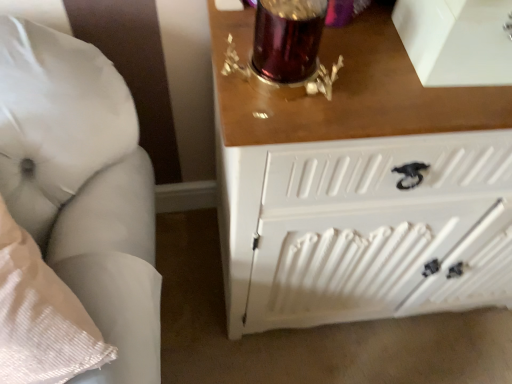
Where is `white painted wood radiator at lower right`? Image resolution: width=512 pixels, height=384 pixels. white painted wood radiator at lower right is located at coordinates (380, 264).

Describe the element at coordinates (380, 264) in the screenshot. Image resolution: width=512 pixels, height=384 pixels. I see `white painted wood radiator at lower right` at that location.

What is the approximate width of white fabric pillow at left?

The width of white fabric pillow at left is 9.09 inches.

What do you see at coordinates (83, 186) in the screenshot?
I see `white fabric pillow at left` at bounding box center [83, 186].

Find the location of a particular element. white fabric pillow at left is located at coordinates (83, 186).

Identify the location of white painted wood radiator at lower right. Image resolution: width=512 pixels, height=384 pixels. (380, 264).

Considering the positions of objects white painted wood radiator at lower right and white fabric pillow at left in the image provided, who is more to the right, white painted wood radiator at lower right or white fabric pillow at left?

Positioned to the right is white painted wood radiator at lower right.

From the picture: Does white painted wood radiator at lower right come behind white fabric pillow at left?

Yes, white painted wood radiator at lower right is further from the camera.

Considering the positions of point (398, 252) and point (113, 193), is point (398, 252) closer or farther from the camera than point (113, 193)?

Point (398, 252) is farther from the camera than point (113, 193).

From the image's perspective, is white painted wood radiator at lower right located beneath white fabric pillow at left?

Indeed, from the image's perspective, white painted wood radiator at lower right is shown beneath white fabric pillow at left.

In the scene shown: From a real-world perspective, who is located higher, white painted wood radiator at lower right or white fabric pillow at left?

From a 3D spatial view, white fabric pillow at left is above.

In terms of width, does white painted wood radiator at lower right look wider or thinner when compared to white fabric pillow at left?

Clearly, white painted wood radiator at lower right has more width compared to white fabric pillow at left.

Who is taller, white painted wood radiator at lower right or white fabric pillow at left?

Standing taller between the two is white fabric pillow at left.

Between white painted wood radiator at lower right and white fabric pillow at left, which one has smaller size?

With smaller size is white painted wood radiator at lower right.

Is white painted wood radiator at lower right surrounding white fabric pillow at left?

Actually, white fabric pillow at left is outside white painted wood radiator at lower right.

Are white painted wood radiator at lower right and white fabric pillow at left located far from each other?

white painted wood radiator at lower right is near white fabric pillow at left, not far away.

Is white painted wood radiator at lower right aimed at white fabric pillow at left?

No.

How different are the orientations of white painted wood radiator at lower right and white fabric pillow at left in degrees?

The angular difference between white painted wood radiator at lower right and white fabric pillow at left is 28.9 degrees.

Locate an element on the screen. furniture on the left of the white painted wood radiator at lower right is located at coordinates (83, 186).

Considering the relative positions of white fabric pillow at left and white painted wood radiator at lower right in the image provided, is white fabric pillow at left to the left or to the right of white painted wood radiator at lower right?

white fabric pillow at left is to the left of white painted wood radiator at lower right.

Which object is closer to the camera, white fabric pillow at left or white painted wood radiator at lower right?

Positioned in front is white fabric pillow at left.

Which point is more forward, (35, 236) or (403, 250)?

The point (35, 236) is closer.

From the image's perspective, which one is positioned lower, white fabric pillow at left or white painted wood radiator at lower right?

white painted wood radiator at lower right.

From a real-world perspective, which object rests below the other?

In real-world perspective, white painted wood radiator at lower right is lower.

Which object is thinner, white fabric pillow at left or white painted wood radiator at lower right?

Thinner between the two is white fabric pillow at left.

Considering the relative sizes of white fabric pillow at left and white painted wood radiator at lower right in the image provided, is white fabric pillow at left taller than white painted wood radiator at lower right?

Correct, white fabric pillow at left is much taller as white painted wood radiator at lower right.

Does white fabric pillow at left have a larger size compared to white painted wood radiator at lower right?

Correct, white fabric pillow at left is larger in size than white painted wood radiator at lower right.

Can white painted wood radiator at lower right be found inside white fabric pillow at left?

Actually, white painted wood radiator at lower right is outside white fabric pillow at left.

Is white fabric pillow at left directly adjacent to white painted wood radiator at lower right?

No, white fabric pillow at left is not with white painted wood radiator at lower right.

Is white painted wood radiator at lower right at the back of white fabric pillow at left?

No, white fabric pillow at left's orientation is not away from white painted wood radiator at lower right.

Measure the distance from white fabric pillow at left to white painted wood radiator at lower right.

white fabric pillow at left is 16.09 inches away from white painted wood radiator at lower right.

You are a GUI agent. You are given a task and a screenshot of the screen. Output one action in this format:
    pyautogui.click(x=<x>, y=<y>)
    Task: Click on the furniture that appears in front of the white painted wood radiator at lower right
    The width and height of the screenshot is (512, 384).
    Given the screenshot: What is the action you would take?
    pyautogui.click(x=83, y=186)

Locate an element on the screen. Image resolution: width=512 pixels, height=384 pixels. furniture that is in front of the white painted wood radiator at lower right is located at coordinates (83, 186).

Identify the location of radiator that is below the white fabric pillow at left (from the image's perspective). Image resolution: width=512 pixels, height=384 pixels. (380, 264).